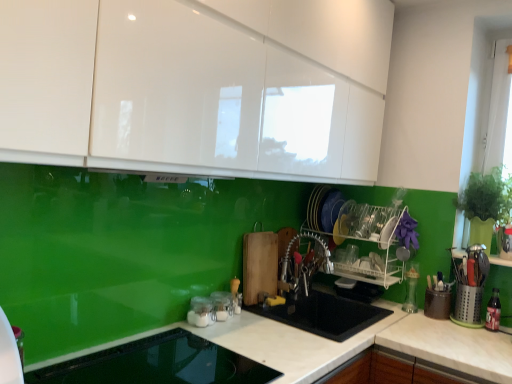
Locate an element on the screen. The width and height of the screenshot is (512, 384). vacant space in front of clear glass jars at lower center, which is counted as the 5th appliance, starting from the back is located at coordinates (193, 339).